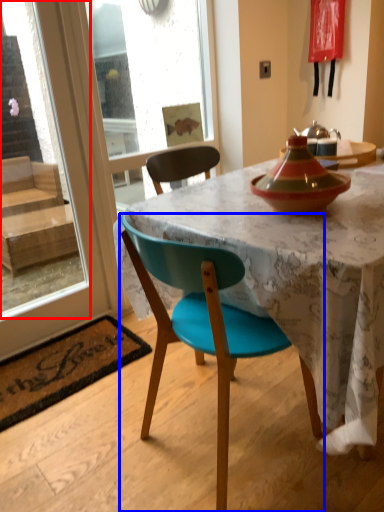
Question: Which of the following is the closest to the observer, window screen (highlighted by a red box) or chair (highlighted by a blue box)?

Choices:
 (A) window screen
 (B) chair

Answer: (B)